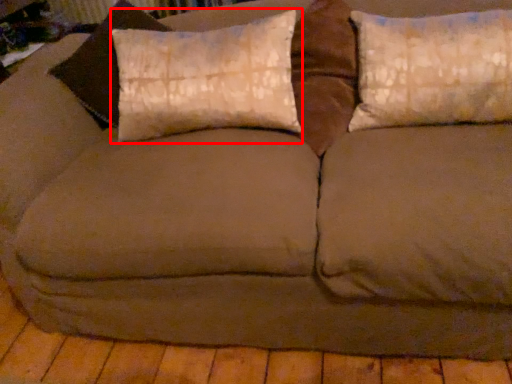
Question: From the image's perspective, considering the relative positions of pillow (annotated by the red box) and pillow in the image provided, where is pillow (annotated by the red box) located with respect to the staircase?

Choices:
 (A) below
 (B) above

Answer: (A)